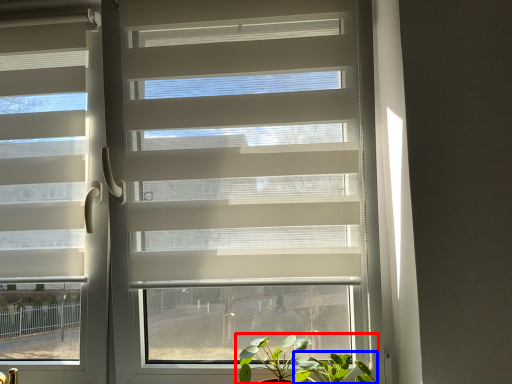
Question: Among these objects, which one is nearest to the camera, houseplant (highlighted by a red box) or vegetation (highlighted by a blue box)?

Choices:
 (A) houseplant
 (B) vegetation

Answer: (B)